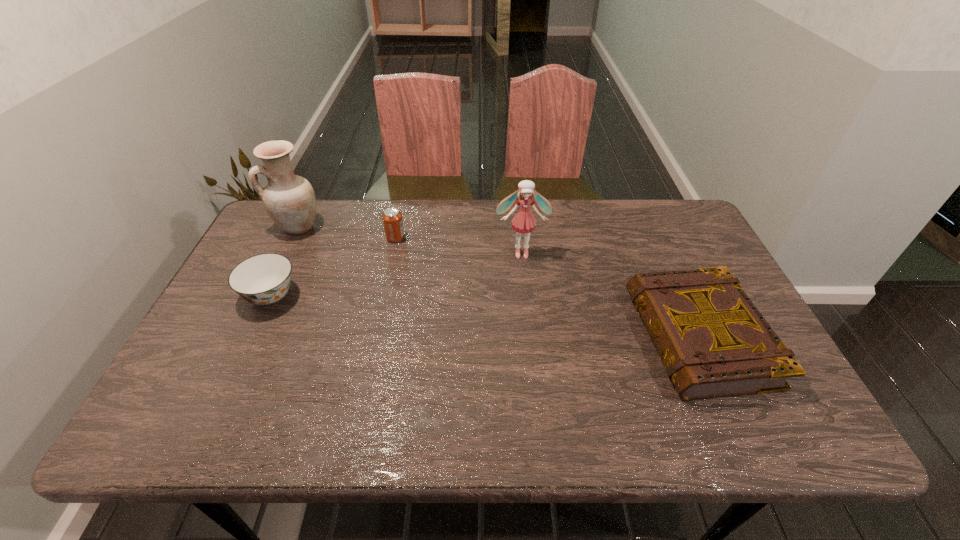
This screenshot has width=960, height=540. In order to click on free space at the left edge of the desktop in this screenshot , I will do `click(258, 317)`.

At what (x,y) coordinates should I click in order to perform the action: click on blank area at the near left corner. Please return your answer as a coordinate pair (x, y). The width and height of the screenshot is (960, 540). Looking at the image, I should click on (194, 442).

Find the location of a particular element. The height and width of the screenshot is (540, 960). free region at the far right corner is located at coordinates (671, 233).

This screenshot has width=960, height=540. What are the coordinates of `free space between the pottery and the third object from left to right` in the screenshot? It's located at tap(347, 232).

Identify the location of blank region between the soup bowl and the third nearest object. The height and width of the screenshot is (540, 960). (396, 274).

Where is `vacant space that is in between the can and the second object from right to left`? The image size is (960, 540). vacant space that is in between the can and the second object from right to left is located at coordinates (459, 245).

At what (x,y) coordinates should I click in order to perform the action: click on vacant point located between the doll and the third object from left to right. Please return your answer as a coordinate pair (x, y). The width and height of the screenshot is (960, 540). Looking at the image, I should click on (459, 245).

Where is `empty space between the fourth object from left to right and the soup bowl`? This screenshot has height=540, width=960. empty space between the fourth object from left to right and the soup bowl is located at coordinates (396, 274).

Where is `free space between the soup bowl and the second object from right to left`? free space between the soup bowl and the second object from right to left is located at coordinates (396, 274).

Locate an element on the screen. Image resolution: width=960 pixels, height=540 pixels. empty space that is in between the pottery and the third object from left to right is located at coordinates (347, 232).